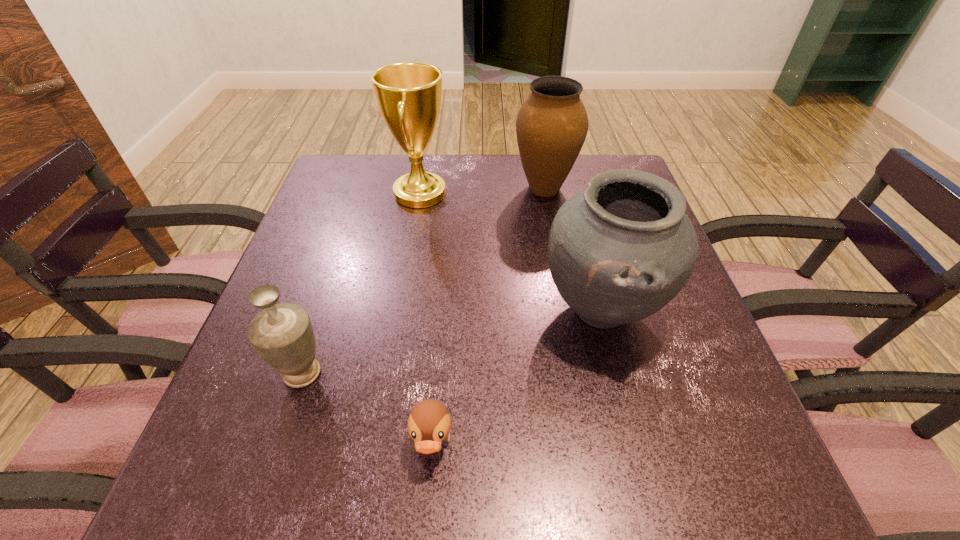
What are the coordinates of `urn situated at the far edge` in the screenshot? It's located at (552, 124).

This screenshot has width=960, height=540. In order to click on object at the near edge in this screenshot , I will do `click(429, 423)`.

Where is `object that is at the left edge`? The height and width of the screenshot is (540, 960). object that is at the left edge is located at coordinates (282, 334).

In order to click on object located in the right edge section of the desktop in this screenshot , I will do `click(620, 250)`.

Find the location of a particular element. Image resolution: width=960 pixels, height=540 pixels. vacant space at the far edge is located at coordinates (503, 191).

At what (x,y) coordinates should I click in order to perform the action: click on vacant point at the left edge. Please return your answer as a coordinate pair (x, y). Looking at the image, I should click on click(332, 316).

Image resolution: width=960 pixels, height=540 pixels. In the image, there is a desktop. Find the location of `free space at the right edge`. free space at the right edge is located at coordinates (670, 408).

You are a GUI agent. You are given a task and a screenshot of the screen. Output one action in this format:
    pyautogui.click(x=<x>, y=<y>)
    Task: Click on the vacant space at the far left corner of the desktop
    This screenshot has width=960, height=540.
    Given the screenshot: What is the action you would take?
    pyautogui.click(x=372, y=154)

The image size is (960, 540). I want to click on free space at the near left corner of the desktop, so click(205, 483).

The height and width of the screenshot is (540, 960). Find the location of `vacant area between the award and the leftmost urn`. vacant area between the award and the leftmost urn is located at coordinates (361, 284).